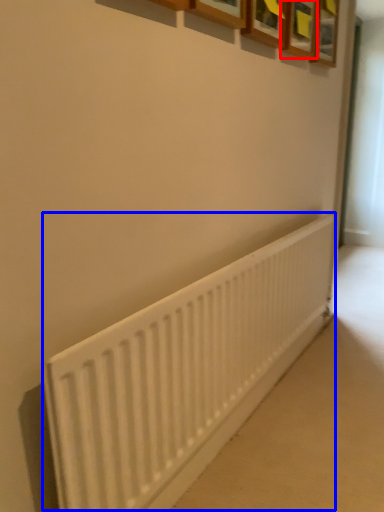
Question: Which object is further to the camera taking this photo, picture frame (highlighted by a red box) or radiator (highlighted by a blue box)?

Choices:
 (A) picture frame
 (B) radiator

Answer: (A)